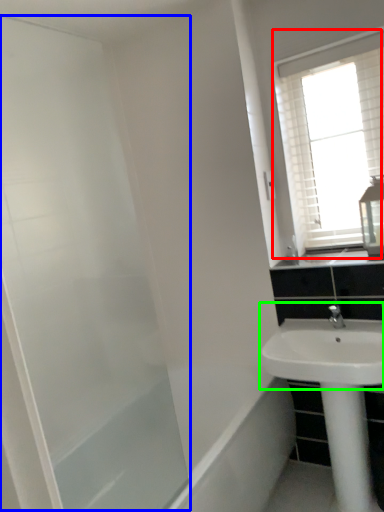
Question: Based on their relative distances, which object is farther from window (highlighted by a red box)? Choose from screen door (highlighted by a blue box) and sink (highlighted by a green box).

Choices:
 (A) screen door
 (B) sink

Answer: (A)